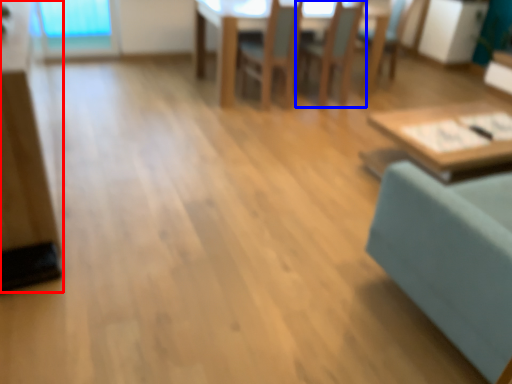
Question: Which object is closer to the camera taking this photo, dresser (highlighted by a red box) or chair (highlighted by a blue box)?

Choices:
 (A) dresser
 (B) chair

Answer: (A)